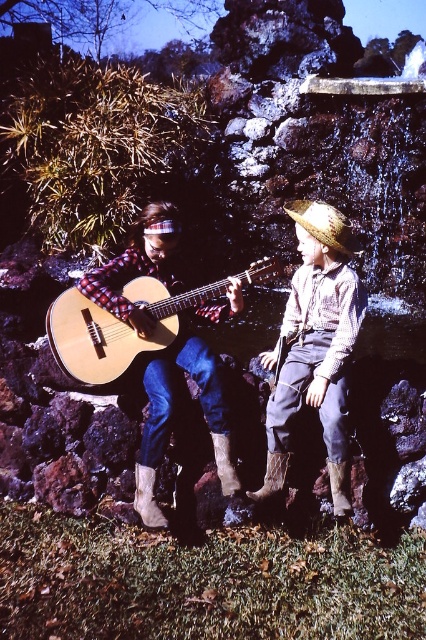
You are a photographer setting up a shoot in this garden scene. You notice two brown cowboy boots in the foreground. The first is a brown suede cowboy boot at lower left, and the second is a brown woven leather cowboy boot at lower center. To ensure both boots are visible in your composition, which boot should you adjust to avoid blocking the other?

The brown suede cowboy boot at lower left is positioned under the brown woven leather cowboy boot at lower center. To ensure both are visible, you should adjust the brown suede cowboy boot at lower left so it is no longer underneath the other boot.

You are a shoemaker examining two cowboy boots in the image. The first is the brown suede cowboy boot at lower left, and the second is the brown woven leather cowboy boot at lower center. Which boot would require more material to craft?

The brown suede cowboy boot at lower left would require more material to craft since it is larger in size than the brown woven leather cowboy boot at lower center.